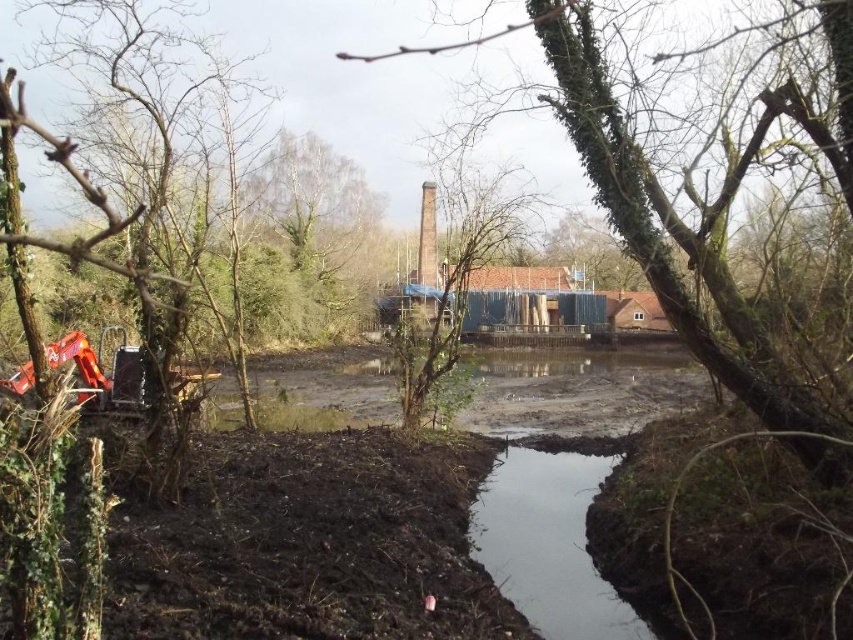
You are a construction worker who needs to cross from the muddy bank to the other side of the clear water at center. There is a green mossy tree at center in the way. Can you walk around the tree to reach the other side?

The clear water at center is larger in size than the green mossy tree at center, so yes, you can walk around the green mossy tree at center to reach the other side.

You are standing at point (666,314) and want to walk to point (599,592). Based on the scene description, will you be moving towards the building or away from it?

Since point (599,592) is behind point (666,314), moving from point (666,314) to point (599,592) would mean moving away from the building towards the background of the scene.